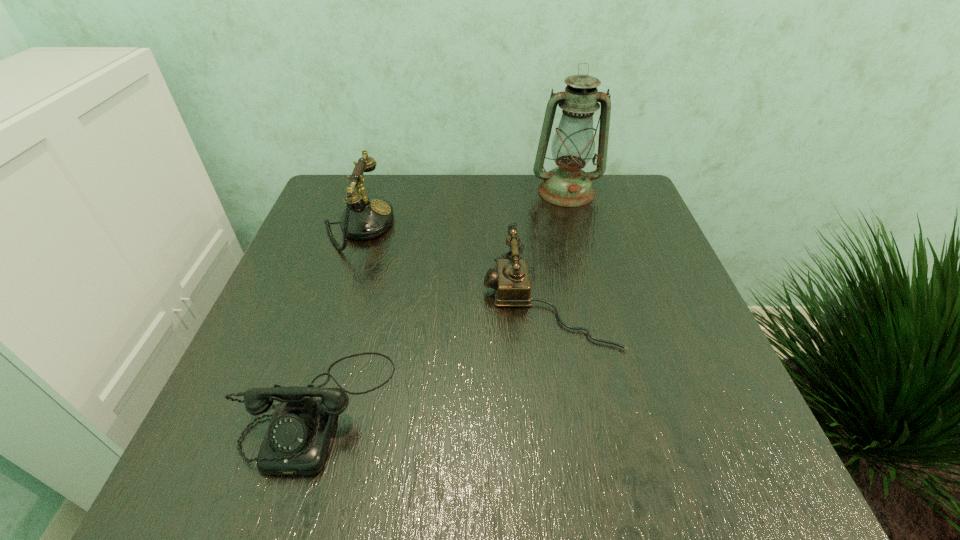
This screenshot has width=960, height=540. I want to click on free space at the far edge, so click(490, 207).

Identify the location of free spot at the left edge of the desktop. (324, 249).

Find the location of a particular element. free point at the right edge is located at coordinates (666, 270).

This screenshot has height=540, width=960. I want to click on vacant space at the far left corner of the desktop, so click(x=382, y=183).

In the image, there is a desktop. Identify the location of free space at the far right corner. 614,187.

Find the location of a particular element. The width and height of the screenshot is (960, 540). free location at the near right corner is located at coordinates (672, 483).

Image resolution: width=960 pixels, height=540 pixels. Find the location of `vacant region between the tallest telephone and the oil lamp`. vacant region between the tallest telephone and the oil lamp is located at coordinates (462, 208).

Locate an element on the screen. vacant region between the oil lamp and the nearest telephone is located at coordinates (441, 300).

Image resolution: width=960 pixels, height=540 pixels. Find the location of `vacant area that lies between the farthest telephone and the oil lamp`. vacant area that lies between the farthest telephone and the oil lamp is located at coordinates (462, 208).

I want to click on vacant area that lies between the shortest object and the second shortest telephone, so click(431, 354).